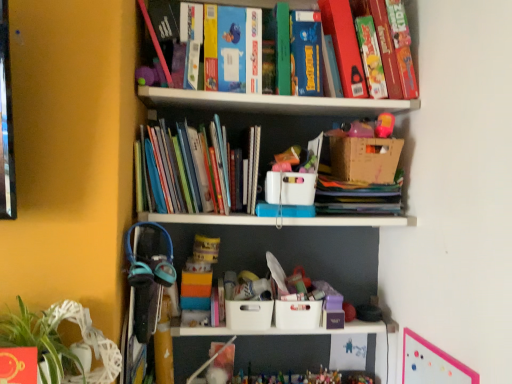
The image size is (512, 384). In order to click on pink matte bulletin board at upper right in this screenshot , I will do `click(431, 363)`.

Find the location of a particular element. This screenshot has width=512, height=384. hardcover book at upper right, the 1th book in the top-to-bottom sequence is located at coordinates (390, 49).

This screenshot has width=512, height=384. Describe the element at coordinates (390, 49) in the screenshot. I see `hardcover book at upper right, the 1th book in the top-to-bottom sequence` at that location.

What is the approximate width of white plastic basket at center, the first storage box from the top?

12.36 inches.

What do you see at coordinates (248, 315) in the screenshot? The height and width of the screenshot is (384, 512). I see `white plastic storage box at lower center, which is the 2th storage box from bottom to top` at bounding box center [248, 315].

You are a GUI agent. You are given a task and a screenshot of the screen. Output one action in this format:
    pyautogui.click(x=<x>, y=<y>)
    Task: Click on the pink matte bulletin board at upper right
    Image resolution: width=512 pixels, height=384 pixels.
    Given the screenshot: What is the action you would take?
    pyautogui.click(x=431, y=363)

From the image's perspective, which is below, white plastic basket at center, the third storage box positioned from the bottom, or matte pink toy at upper right?

From the image's view, white plastic basket at center, the third storage box positioned from the bottom, is below.

In the scene shown: Between white plastic basket at center, the first storage box from the top, and matte pink toy at upper right, which one has smaller width?

matte pink toy at upper right.

Considering the sizes of objects white plastic basket at center, the first storage box from the top, and matte pink toy at upper right in the image provided, who is smaller, white plastic basket at center, the first storage box from the top, or matte pink toy at upper right?

Smaller between the two is matte pink toy at upper right.

Considering the positions of objects white plastic basket at center, the third storage box positioned from the bottom, and matte pink toy at upper right in the image provided, who is more to the left, white plastic basket at center, the third storage box positioned from the bottom, or matte pink toy at upper right?

white plastic basket at center, the third storage box positioned from the bottom.

Looking at the image, does cardboard box at upper right seem bigger or smaller compared to hardcover book at upper right, the 1th book in the top-to-bottom sequence?

Clearly, cardboard box at upper right is smaller in size than hardcover book at upper right, the 1th book in the top-to-bottom sequence.

Between cardboard box at upper right and hardcover book at upper right, the 1th book in the top-to-bottom sequence, which one has smaller width?

cardboard box at upper right.

Is point (359, 138) more distant than point (399, 45)?

No.

Is matte pink toy at upper right beside white plastic storage box at lower center, acting as the 2th storage box starting from the top?

There is a gap between matte pink toy at upper right and white plastic storage box at lower center, acting as the 2th storage box starting from the top.

Is matte pink toy at upper right turned away from white plastic storage box at lower center, acting as the 2th storage box starting from the top?

No, matte pink toy at upper right is not facing the opposite direction of white plastic storage box at lower center, acting as the 2th storage box starting from the top.

Is matte pink toy at upper right surrounding white plastic storage box at lower center, which is the 2th storage box from bottom to top?

That's incorrect, white plastic storage box at lower center, which is the 2th storage box from bottom to top, is not inside matte pink toy at upper right.

Considering the relative sizes of matte pink toy at upper right and white plastic storage box at lower center, acting as the 2th storage box starting from the top, in the image provided, is matte pink toy at upper right smaller than white plastic storage box at lower center, acting as the 2th storage box starting from the top,?

No.

Which is more to the right, matte pink toy at upper right or white plastic storage box at center, the third storage box viewed from the top?

Positioned to the right is matte pink toy at upper right.

Is matte pink toy at upper right oriented away from white plastic storage box at center, acting as the 1th storage box starting from the bottom?

matte pink toy at upper right is not turned away from white plastic storage box at center, acting as the 1th storage box starting from the bottom.

Is matte pink toy at upper right next to white plastic storage box at center, the third storage box viewed from the top?

No, matte pink toy at upper right is not making contact with white plastic storage box at center, the third storage box viewed from the top.

Who is taller, matte pink toy at upper right or white plastic storage box at center, acting as the 1th storage box starting from the bottom?

white plastic storage box at center, acting as the 1th storage box starting from the bottom, is taller.

Is point (448, 367) less distant than point (367, 143)?

Yes, it is.

From a real-world perspective, relative to cardboard box at upper right, is pink matte bulletin board at upper right vertically above or below?

From a real-world perspective, pink matte bulletin board at upper right is physically below cardboard box at upper right.

Looking at this image, considering the relative sizes of pink matte bulletin board at upper right and cardboard box at upper right in the image provided, is pink matte bulletin board at upper right thinner than cardboard box at upper right?

Yes.

Looking at this image, can you tell me how much pink matte bulletin board at upper right and cardboard box at upper right differ in facing direction?

The angular difference between pink matte bulletin board at upper right and cardboard box at upper right is 90 degrees.

Which object is closer to the camera taking this photo, white wicker swivel chair at lower left or hardcover book at upper right, the 2th book from the bottom?

white wicker swivel chair at lower left.

Based on the photo, is there a large distance between white wicker swivel chair at lower left and hardcover book at upper right, the second book in the left-to-right sequence?

Yes, white wicker swivel chair at lower left is far from hardcover book at upper right, the second book in the left-to-right sequence.

From a real-world perspective, is white wicker swivel chair at lower left positioned above or below hardcover book at upper right, the 2th book from the bottom?

white wicker swivel chair at lower left is situated lower than hardcover book at upper right, the 2th book from the bottom, in the real world.

Considering their positions, is cardboard box at upper right located in front of or behind pink matte bulletin board at upper right?

Visually, cardboard box at upper right is located behind pink matte bulletin board at upper right.

From the picture: Considering the relative positions of cardboard box at upper right and pink matte bulletin board at upper right in the image provided, is cardboard box at upper right to the left or to the right of pink matte bulletin board at upper right?

In the image, cardboard box at upper right appears on the left side of pink matte bulletin board at upper right.

Does cardboard box at upper right have a greater height compared to pink matte bulletin board at upper right?

No, cardboard box at upper right is not taller than pink matte bulletin board at upper right.

Is point (361, 164) positioned before point (439, 375)?

No, it is not.

Where is `storage box that appears in front of the matte pink toy at upper right`? storage box that appears in front of the matte pink toy at upper right is located at coordinates (290, 188).

This screenshot has width=512, height=384. What are the coordinates of `cardboard box lying below the hardcover book at upper right, marked as the first book in a right-to-left arrangement (from the image's perspective)` in the screenshot? It's located at (365, 159).

When comparing their distances from white plastic storage box at lower center, which is the 2th storage box from bottom to top, does white plastic basket at center, the first storage box from the top, or pink matte bulletin board at upper right seem further?

pink matte bulletin board at upper right is further to white plastic storage box at lower center, which is the 2th storage box from bottom to top.

When comparing their distances from hardcover book at upper right, the second book in the left-to-right sequence, does pink matte bulletin board at upper right or cardboard box at upper right seem further?

The object further to hardcover book at upper right, the second book in the left-to-right sequence, is pink matte bulletin board at upper right.

When comparing their distances from pink matte bulletin board at upper right, does white plastic storage box at center, acting as the 1th storage box starting from the bottom, or white plastic basket at center, the third storage box positioned from the bottom, seem closer?

white plastic storage box at center, acting as the 1th storage box starting from the bottom, lies closer to pink matte bulletin board at upper right than the other object.

Which object lies further to the anchor point white plastic basket at center, the first storage box from the top, white plastic storage box at center, acting as the 1th storage box starting from the bottom, or hardcover book at upper right, marked as the first book in a right-to-left arrangement?

hardcover book at upper right, marked as the first book in a right-to-left arrangement, lies further to white plastic basket at center, the first storage box from the top, than the other object.

From the image, which object appears to be nearer to matte pink toy at upper right, pink matte bulletin board at upper right or white plastic storage box at center, the third storage box viewed from the top?

Among the two, white plastic storage box at center, the third storage box viewed from the top, is located nearer to matte pink toy at upper right.

Considering their positions, is white plastic storage box at lower center, which is the 2th storage box from bottom to top, positioned closer to white wicker swivel chair at lower left than white plastic basket at center, the first storage box from the top?

white plastic storage box at lower center, which is the 2th storage box from bottom to top, is positioned closer to the anchor white wicker swivel chair at lower left.

Estimate the real-world distances between objects in this image. Which object is further from matte pink toy at upper right, hardcover book at upper right, the second book in the left-to-right sequence, or pink matte bulletin board at upper right?

pink matte bulletin board at upper right is further to matte pink toy at upper right.

Which object lies nearer to the anchor point matte pink toy at upper right, white wicker swivel chair at lower left or white plastic basket at center, the third storage box positioned from the bottom?

Among the two, white plastic basket at center, the third storage box positioned from the bottom, is located nearer to matte pink toy at upper right.

Where is `toy between hardcover book at upper right, the 1th book in the top-to-bottom sequence, and cardboard box at upper right from top to bottom`? The width and height of the screenshot is (512, 384). toy between hardcover book at upper right, the 1th book in the top-to-bottom sequence, and cardboard box at upper right from top to bottom is located at coordinates (365, 128).

Identify the location of cardboard box between white wicker swivel chair at lower left and pink matte bulletin board at upper right. (365, 159).

I want to click on cardboard box between matte pink toy at upper right and white plastic storage box at center, acting as the 1th storage box starting from the bottom, in the vertical direction, so click(365, 159).

Find the location of a particular element. book that lies between hardcover book at upper right, the 1th book in the top-to-bottom sequence, and pink matte bulletin board at upper right from top to bottom is located at coordinates tap(190, 169).